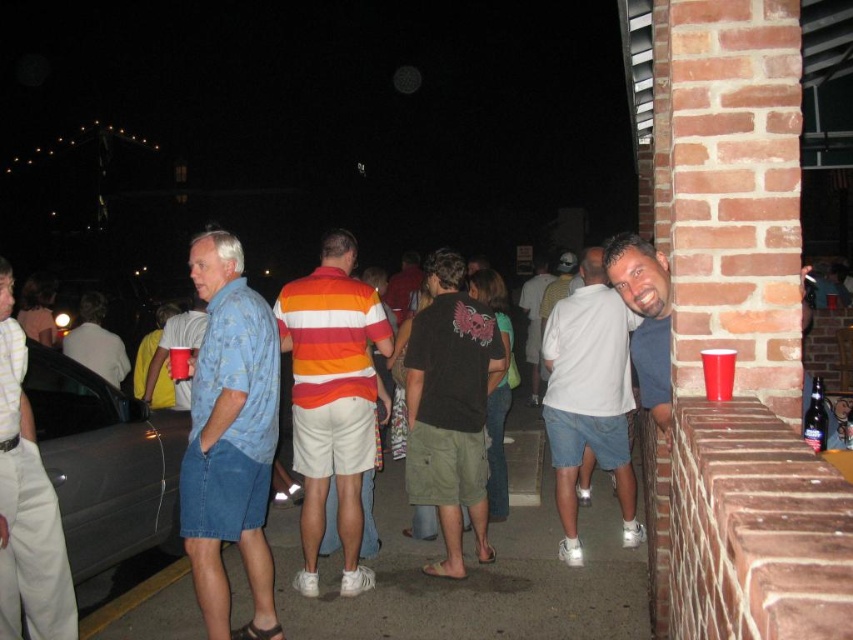
You are at a party and need to determine which item takes up more space between the blue denim shorts at left and the brushed metal shirt at left. Which one is it?

The brushed metal shirt at left takes up more space than the blue denim shorts at left.

You are a photographer at the event and want to capture a photo of both the blue denim shorts at left and the brushed metal shirt at left in the same frame. Given that your camera has a minimum focus distance of 28 inches, will you be able to achieve this without moving either object?

The distance between the blue denim shorts at left and the brushed metal shirt at left is 28.54 inches, which is just over the camera minimum focus distance of 28 inches. Therefore, you can capture both items in the same frame without moving them.